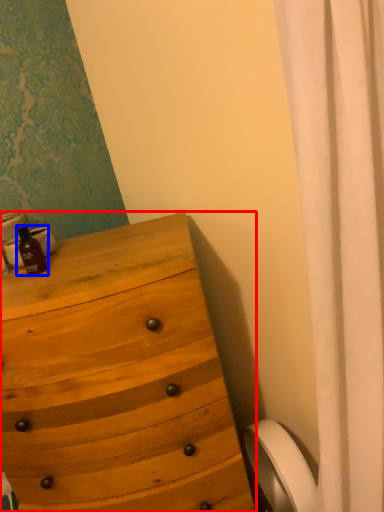
Question: Which object is closer to the camera taking this photo, chest of drawers (highlighted by a red box) or bottle (highlighted by a blue box)?

Choices:
 (A) chest of drawers
 (B) bottle

Answer: (A)